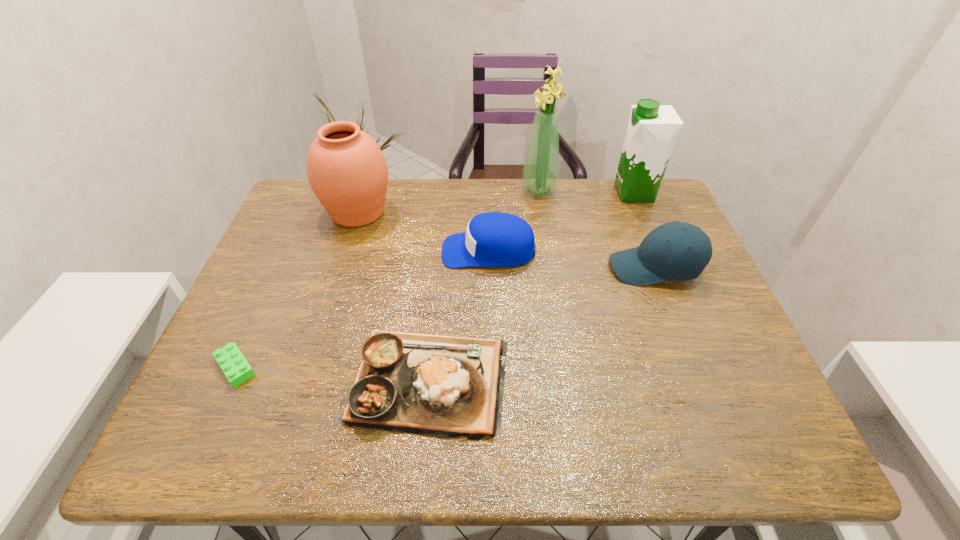
Where is `bouquet`? bouquet is located at coordinates (540, 171).

This screenshot has width=960, height=540. In order to click on soya milk in this screenshot , I will do `click(652, 130)`.

Locate an element on the screen. This screenshot has height=540, width=960. urn is located at coordinates (347, 171).

Find the location of a particular element. The height and width of the screenshot is (540, 960). the fourth shortest object is located at coordinates (676, 250).

Where is `the right baseball cap`? the right baseball cap is located at coordinates (676, 250).

Find the location of `the fifth tallest object`. the fifth tallest object is located at coordinates (493, 239).

Identify the location of the left baseball cap. (493, 239).

Identify the location of platter. The image size is (960, 540). (415, 383).

This screenshot has width=960, height=540. What are the coordinates of `Lego` in the screenshot? It's located at [x=234, y=365].

Locate an element on the screen. The width and height of the screenshot is (960, 540). free location located 0.220m on the front-facing side of the tallest object is located at coordinates (452, 190).